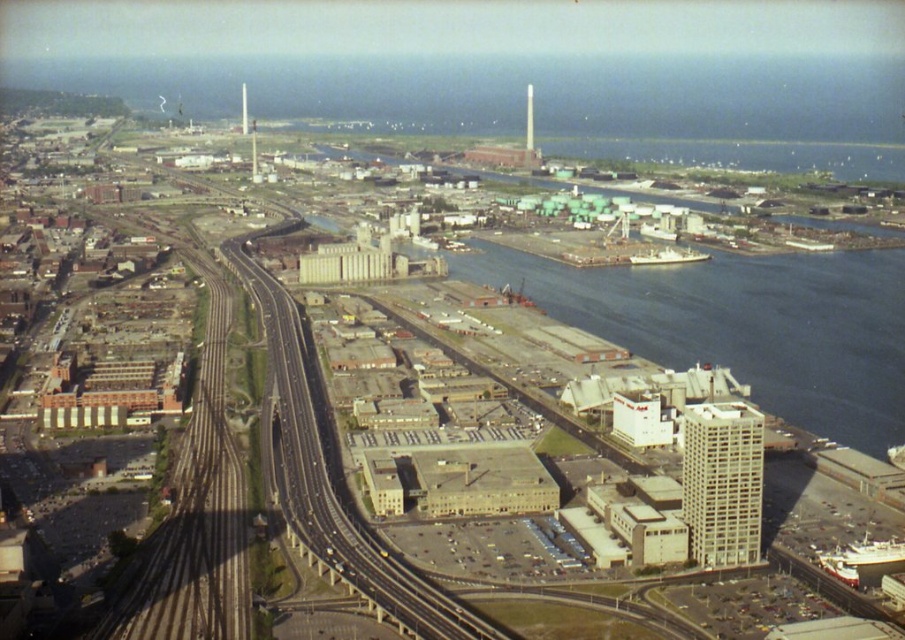
Looking at the urban industrial area from above, you see blue water at center and concrete railway at center. Which one is positioned to the right side?

The blue water at center is to the right of the concrete railway at center.

You are a drone operator flying over an urban industrial area. You notice the blue water at center and the concrete railway at center. From your aerial view, which one appears closer to you?

The blue water at center is in front of the concrete railway at center, so it appears closer from the aerial view.